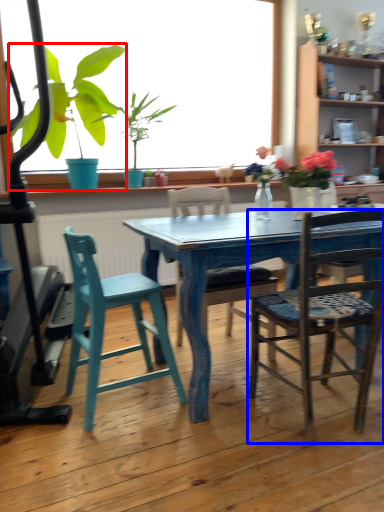
Question: Which object is closer to the camera taking this photo, houseplant (highlighted by a red box) or chair (highlighted by a blue box)?

Choices:
 (A) houseplant
 (B) chair

Answer: (B)